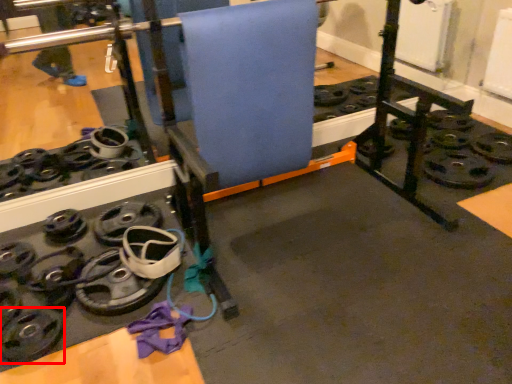
Question: From the image's perspective, where is wheel (annotated by the red box) located in relation to yoga mat in the image?

Choices:
 (A) below
 (B) above

Answer: (A)